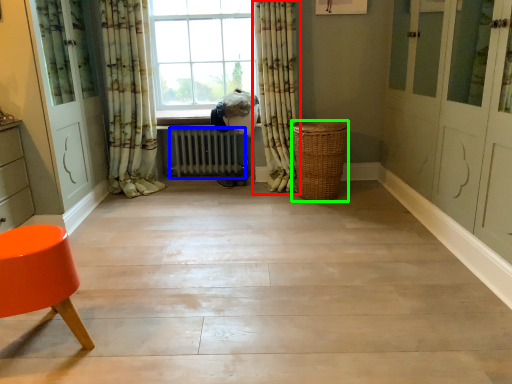
Question: Which object is the farthest from curtain (highlighted by a red box)? Choose among these: radiator (highlighted by a blue box) or basket (highlighted by a green box).

Choices:
 (A) radiator
 (B) basket

Answer: (A)